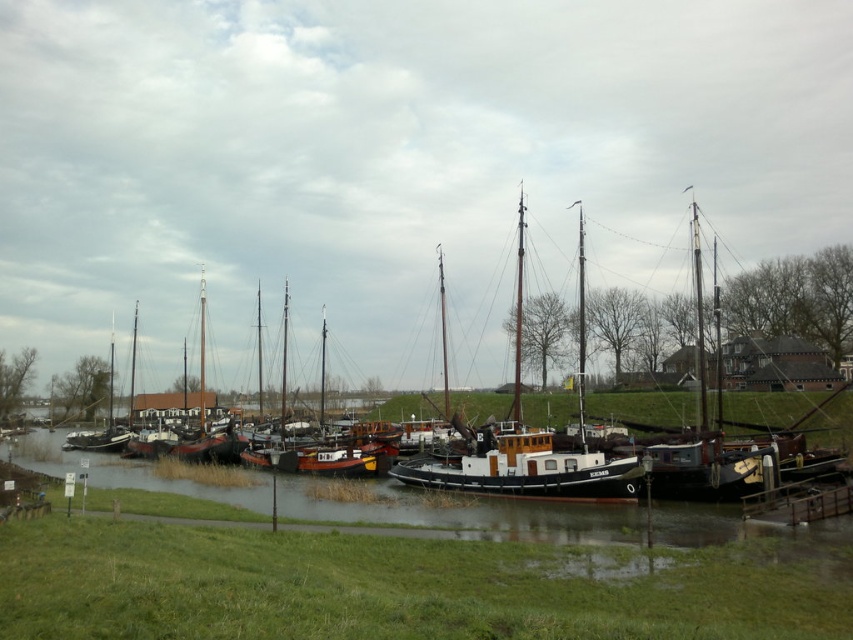
Is wooden boat at center bigger than smooth water at center?

Correct, wooden boat at center is larger in size than smooth water at center.

Does point (753, 465) come closer to viewer compared to point (77, 465)?

Yes.

Who is more distant from viewer, (485, 445) or (436, 515)?

The point (485, 445) is more distant.

The height and width of the screenshot is (640, 853). I want to click on wooden boat at center, so tap(642, 440).

Can you confirm if wooden sailboat at center is positioned above wooden dock at lower right?

Yes.

Is wooden sailboat at center closer to camera compared to wooden dock at lower right?

No, it is not.

Is point (630, 497) positioned before point (843, 481)?

Yes, it is in front of point (843, 481).

Image resolution: width=853 pixels, height=640 pixels. In order to click on wooden sailboat at center in this screenshot , I will do `click(527, 442)`.

Who is lower down, smooth water at center or wooden sailboat at center?

Positioned lower is smooth water at center.

Which is behind, point (811, 556) or point (579, 268)?

The point (579, 268) is behind.

Find the location of a particular element. This screenshot has width=853, height=640. smooth water at center is located at coordinates pyautogui.click(x=463, y=513).

Where is `smooth water at center`? Image resolution: width=853 pixels, height=640 pixels. smooth water at center is located at coordinates (463, 513).